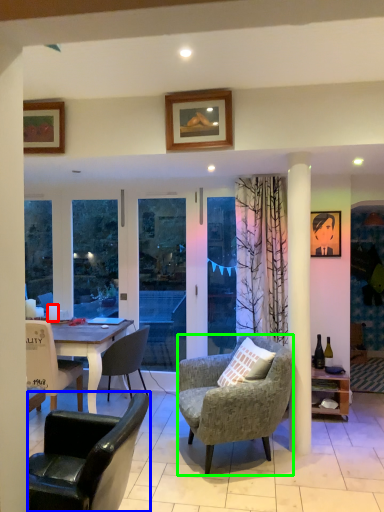
Question: Considering the real-world distances, which object is farthest from coffee cup (highlighted by a red box)? chair (highlighted by a blue box) or chair (highlighted by a green box)?

Choices:
 (A) chair
 (B) chair

Answer: (A)